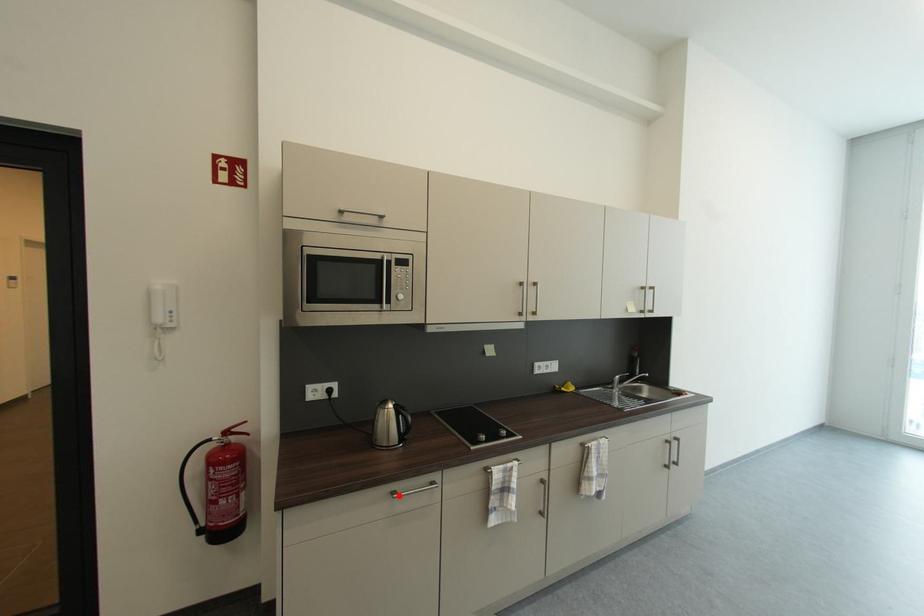
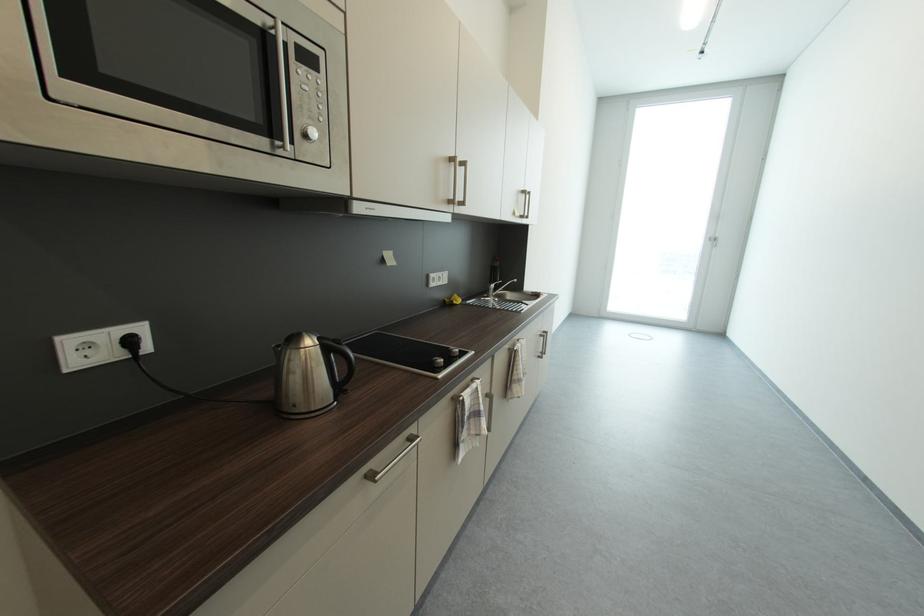
The point at the highlighted location is marked in the first image. Where is the corresponding point in the second image?

(377, 479)